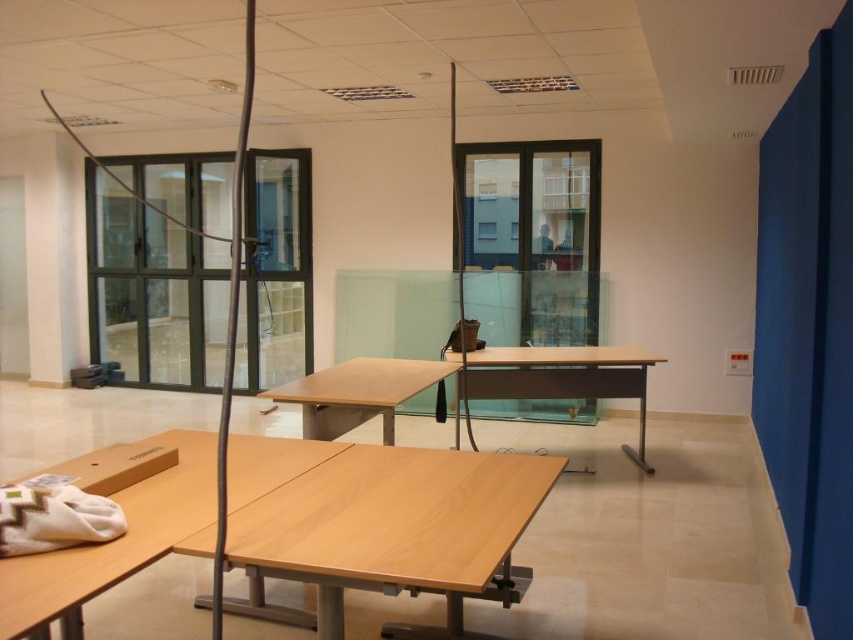
You are planning to move a large rectangular box into the room. The box is 2 meters in length. You see the light brown wood table at center and the transparent glass door at center. Which object do you think the box will pass through more easily?

The transparent glass door at center occupies more space than the light brown wood table at center, so the box will pass through the transparent glass door at center more easily.

You are standing in the classroom and want to exit through the clear glass door at center. To reach it, you need to move around the light brown wood table at center. Which direction should you move relative to the table?

The clear glass door at center is located above the light brown wood table at center, so you should move forward from the table to reach the door.

You are standing in the middle of the room and want to exit through the clear glass door at center. Which direction should you move relative to the light brown wood table at center?

You should move to the left of the light brown wood table at center because the clear glass door at center is located to its left side.